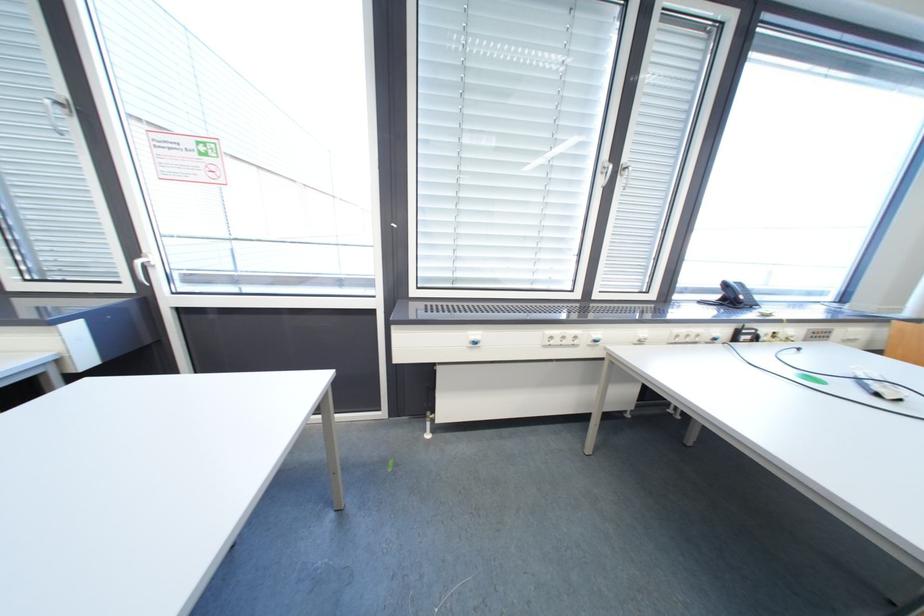
You are a GUI agent. You are given a task and a screenshot of the screen. Output one action in this format:
    pyautogui.click(x=<x>, y=<y>)
    Task: Click on the blue cabinet knob
    This screenshot has height=616, width=924.
    Given the screenshot: What is the action you would take?
    pyautogui.click(x=594, y=338)